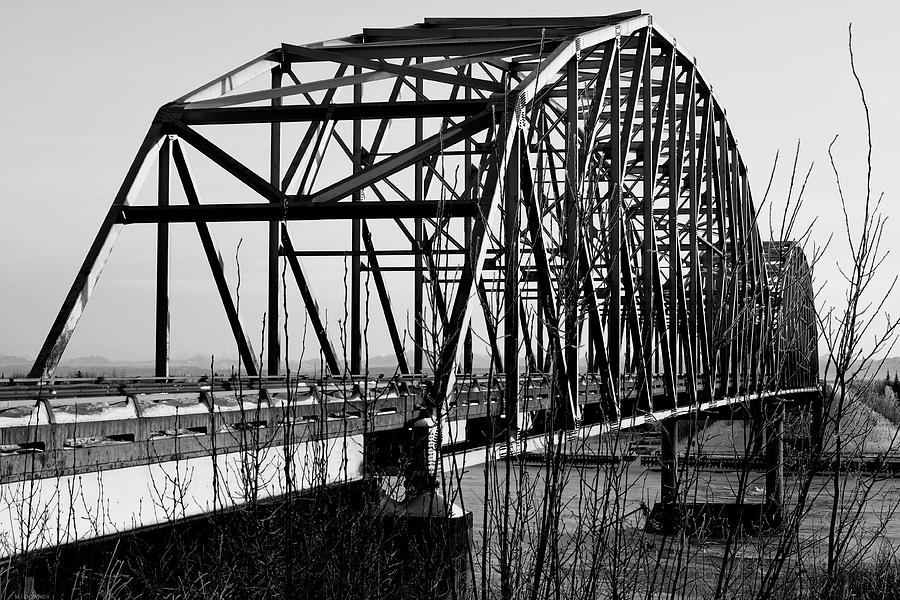
Locate an element on the screen. beams is located at coordinates (670, 464), (775, 458).